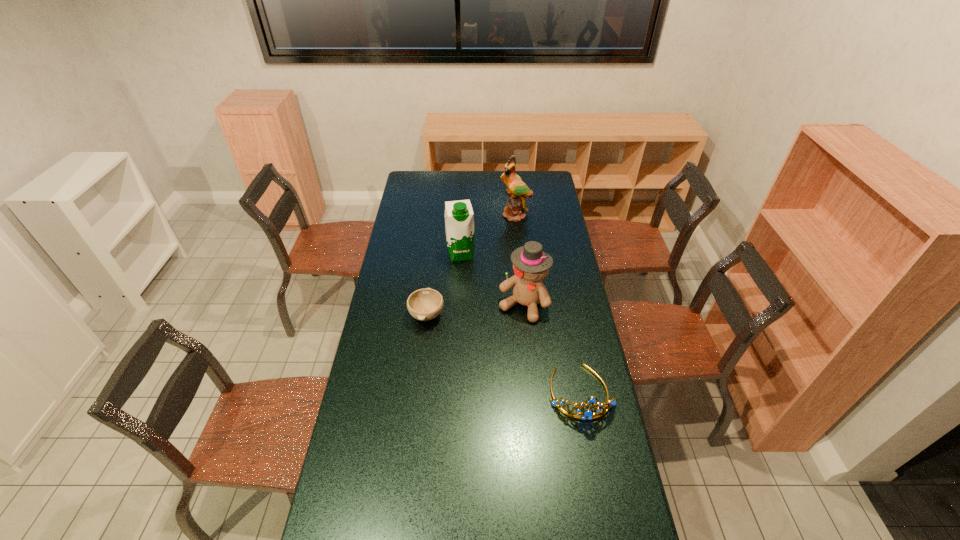
This screenshot has height=540, width=960. I want to click on the shortest object, so click(x=425, y=304).

Find the location of a particular element. Image resolution: width=960 pixels, height=540 pixels. the nearest object is located at coordinates (588, 414).

The height and width of the screenshot is (540, 960). I want to click on the second shortest object, so click(588, 414).

You are a GUI agent. You are given a task and a screenshot of the screen. Output one action in this format:
    pyautogui.click(x=<x>, y=<y>)
    Task: Click on the farthest object
    The image size is (960, 540).
    Given the screenshot: What is the action you would take?
    pyautogui.click(x=517, y=191)

At what (x,y) coordinates should I click in order to perform the action: click on parrot. Please return your answer as a coordinate pair (x, y). Looking at the image, I should click on (517, 191).

The width and height of the screenshot is (960, 540). I want to click on rag_doll, so click(x=531, y=265).

Where is `soya milk`? soya milk is located at coordinates (459, 218).

Where is `blank area located 0.130m on the back of the shortest object`? This screenshot has width=960, height=540. blank area located 0.130m on the back of the shortest object is located at coordinates (431, 279).

You are a GUI agent. You are given a task and a screenshot of the screen. Output one action in this format:
    pyautogui.click(x=<x>, y=<y>)
    Task: Click on the free space located on the front-facing side of the nearest object
    The height and width of the screenshot is (540, 960).
    Given the screenshot: What is the action you would take?
    pyautogui.click(x=594, y=463)

Locate an element on the screen. free space located on the front-facing side of the farthest object is located at coordinates (508, 252).